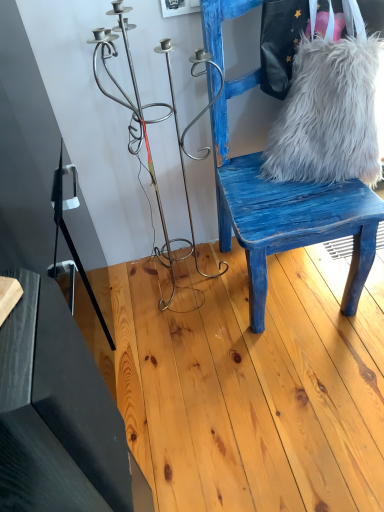
Question: Does white fluffy bag at right contain blue distressed wood chair at right?

Choices:
 (A) no
 (B) yes

Answer: (A)

Question: Is white fluffy bag at right positioned in front of blue distressed wood chair at right?

Choices:
 (A) yes
 (B) no

Answer: (B)

Question: Is white fluffy bag at right positioned behind blue distressed wood chair at right?

Choices:
 (A) yes
 (B) no

Answer: (A)

Question: Is blue distressed wood chair at right at the back of white fluffy bag at right?

Choices:
 (A) no
 (B) yes

Answer: (B)

Question: Is white fluffy bag at right bigger than blue distressed wood chair at right?

Choices:
 (A) yes
 (B) no

Answer: (B)

Question: From the image's perspective, is blue distressed wood chair at right above or below white fluffy fur at right?

Choices:
 (A) above
 (B) below

Answer: (B)

Question: Is blue distressed wood chair at right in front of or behind white fluffy fur at right in the image?

Choices:
 (A) behind
 (B) front

Answer: (B)

Question: From their relative heights in the image, would you say blue distressed wood chair at right is taller or shorter than white fluffy fur at right?

Choices:
 (A) short
 (B) tall

Answer: (B)

Question: Which is correct: blue distressed wood chair at right is inside white fluffy fur at right, or outside of it?

Choices:
 (A) inside
 (B) outside

Answer: (B)

Question: Is white fluffy bag at right situated inside blue distressed wood chair at right or outside?

Choices:
 (A) outside
 (B) inside

Answer: (B)

Question: Considering the positions of white fluffy bag at right and blue distressed wood chair at right in the image, is white fluffy bag at right bigger or smaller than blue distressed wood chair at right?

Choices:
 (A) small
 (B) big

Answer: (A)

Question: From the image's perspective, is white fluffy bag at right above or below blue distressed wood chair at right?

Choices:
 (A) below
 (B) above

Answer: (B)

Question: In terms of width, does white fluffy bag at right look wider or thinner when compared to blue distressed wood chair at right?

Choices:
 (A) wide
 (B) thin

Answer: (B)

Question: From the image's perspective, is white fluffy fur at right located above or below black matte table at lower left?

Choices:
 (A) above
 (B) below

Answer: (A)

Question: Looking at their shapes, would you say white fluffy fur at right is wider or thinner than black matte table at lower left?

Choices:
 (A) thin
 (B) wide

Answer: (A)